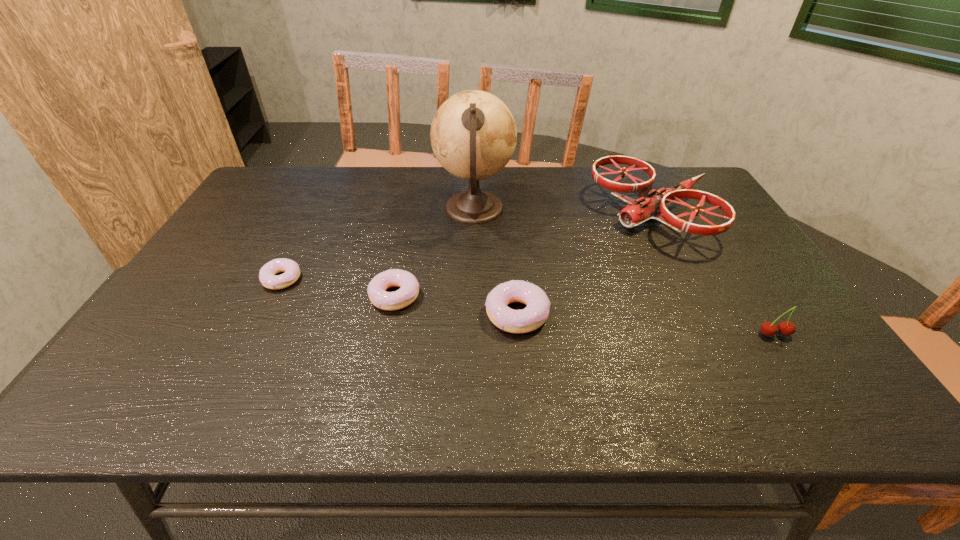
Find the location of a particular element. free space located 0.090m on the left of the second doughnut from right to left is located at coordinates (333, 296).

Find the location of a particular element. This screenshot has width=960, height=540. free location located on the right of the rightmost doughnut is located at coordinates (645, 314).

The width and height of the screenshot is (960, 540). I want to click on vacant space located on the front of the drone, so pos(710,323).

You are a GUI agent. You are given a task and a screenshot of the screen. Output one action in this format:
    pyautogui.click(x=<x>, y=<y>)
    Task: Click on the vacant space situated on the front-facing side of the tallest object
    The width and height of the screenshot is (960, 540).
    Given the screenshot: What is the action you would take?
    pyautogui.click(x=634, y=209)

The image size is (960, 540). Identify the location of vacant space positioned on the surface of the fourth shortest object. (790, 358).

At what (x,y) coordinates should I click in order to perform the action: click on drone present at the far edge. Please return your answer as a coordinate pair (x, y). The width and height of the screenshot is (960, 540). Looking at the image, I should click on (649, 206).

This screenshot has width=960, height=540. What are the coordinates of `globe that is at the far edge` in the screenshot? It's located at (473, 134).

Where is `doughnut that is at the near edge`? doughnut that is at the near edge is located at coordinates (534, 315).

The width and height of the screenshot is (960, 540). Identify the location of cherry present at the near edge. (786, 328).

Find the location of a particular element. drone that is at the right edge is located at coordinates (649, 206).